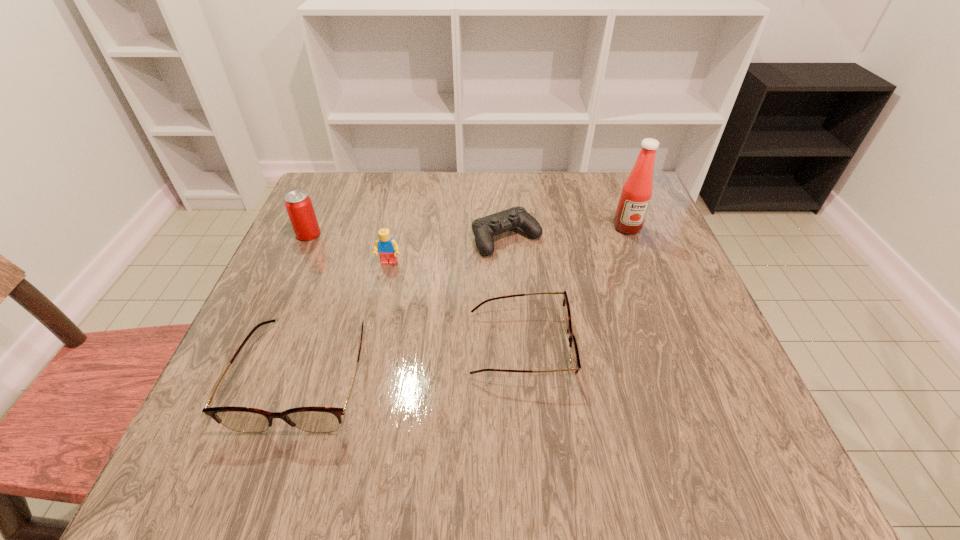
Find the location of `vacant region at the far edge`. vacant region at the far edge is located at coordinates (523, 172).

This screenshot has width=960, height=540. I want to click on vacant space at the near edge of the desktop, so click(x=544, y=388).

In the image, there is a desktop. At what (x,y) coordinates should I click in order to perform the action: click on vacant space at the left edge. Please return your answer as a coordinate pair (x, y). The width and height of the screenshot is (960, 540). Looking at the image, I should click on (266, 334).

The image size is (960, 540). I want to click on free location at the right edge of the desktop, so click(641, 272).

The width and height of the screenshot is (960, 540). I want to click on vacant area at the far left corner of the desktop, so click(368, 175).

Where is `free point at the near left corner`? free point at the near left corner is located at coordinates (218, 393).

In the image, there is a desktop. At what (x,y) coordinates should I click in order to perform the action: click on free space at the far right corner. Please return your answer as a coordinate pair (x, y). Image resolution: width=960 pixels, height=540 pixels. Looking at the image, I should click on pyautogui.click(x=606, y=215).

Find the location of a particular element. The image size is (960, 540). vacant space in between the Lego and the right spectacles is located at coordinates (454, 305).

In order to click on empty space between the third tallest object and the control in this screenshot , I will do `click(448, 251)`.

I want to click on vacant area that lies between the fifth shortest object and the right spectacles, so click(x=414, y=291).